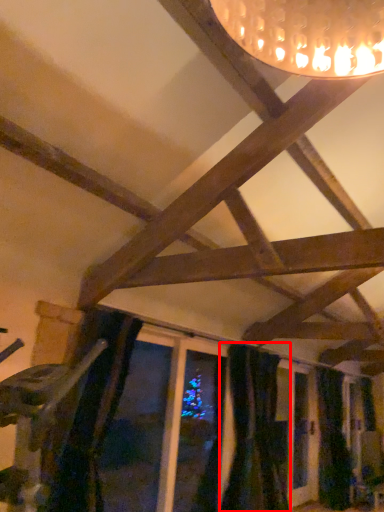
Question: From the image, what is the correct spatial relationship of curtain (annotated by the red box) in relation to curtain?

Choices:
 (A) right
 (B) left

Answer: (B)